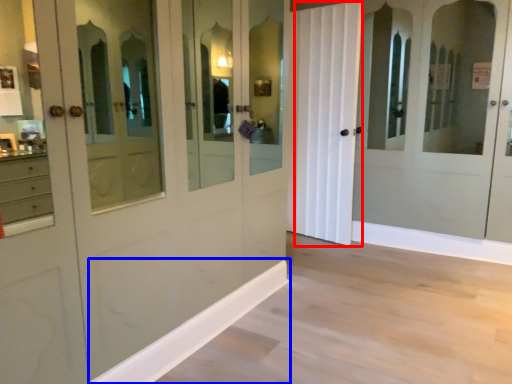
Question: Which of the following is the farthest to the observer, curtain (highlighted by a red box) or molding (highlighted by a blue box)?

Choices:
 (A) curtain
 (B) molding

Answer: (A)